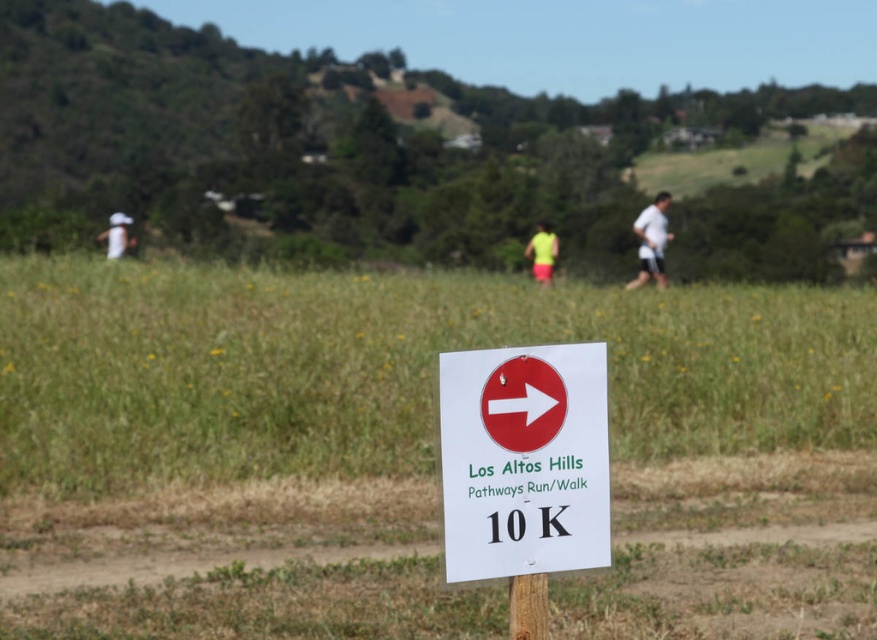
Question: Which is nearer to the white matte shirt at upper right?

Choices:
 (A) green grassy hill at upper center
 (B) brown wooden pole at center

Answer: (A)

Question: Is green grassy hill at upper center wider than white fabric hat at upper left?

Choices:
 (A) no
 (B) yes

Answer: (B)

Question: Observing the image, what is the correct spatial positioning of green grassy hill at upper center in reference to white paper sign at center?

Choices:
 (A) above
 (B) below

Answer: (A)

Question: Which object appears farthest from the camera in this image?

Choices:
 (A) white plastic sign at center
 (B) white matte shirt at upper right

Answer: (B)

Question: Can you confirm if brown wooden pole at center is positioned to the left of white fabric hat at upper left?

Choices:
 (A) yes
 (B) no

Answer: (B)

Question: Among these objects, which one is farthest from the camera?

Choices:
 (A) white matte shirt at upper right
 (B) white plastic sign at center
 (C) white fabric hat at upper left
 (D) neon yellow fabric at center

Answer: (C)